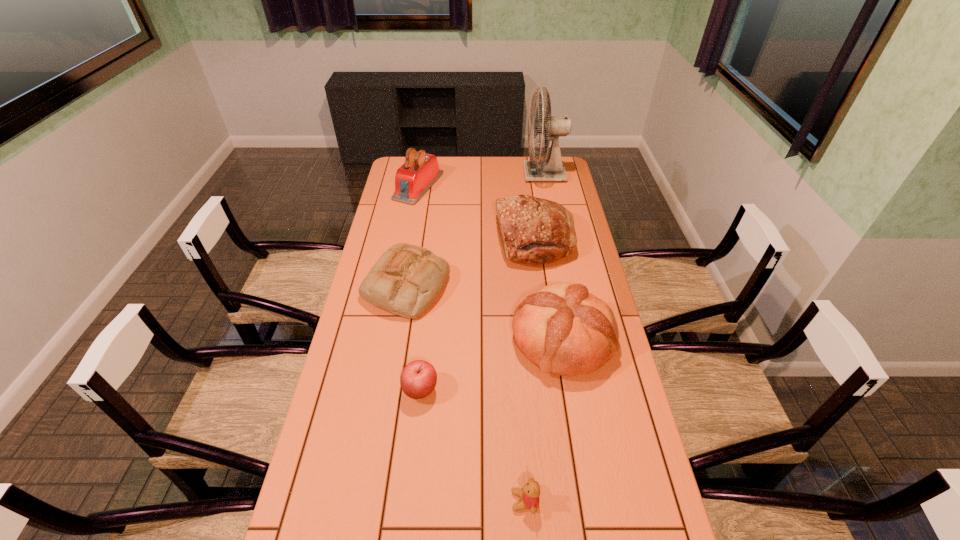
The image size is (960, 540). I want to click on bread that is the closest one to the teddy bear, so click(x=563, y=329).

The width and height of the screenshot is (960, 540). Find the location of `free space that satisfies the following two spatial constraints: 1. on the front side of the fifth tallest object; 2. on the right side of the toaster`. free space that satisfies the following two spatial constraints: 1. on the front side of the fifth tallest object; 2. on the right side of the toaster is located at coordinates (400, 286).

Find the location of `blank area in the image that satisfies the following two spatial constraints: 1. on the front-facing side of the tallest object; 2. on the front side of the shortest bread`. blank area in the image that satisfies the following two spatial constraints: 1. on the front-facing side of the tallest object; 2. on the front side of the shortest bread is located at coordinates (566, 286).